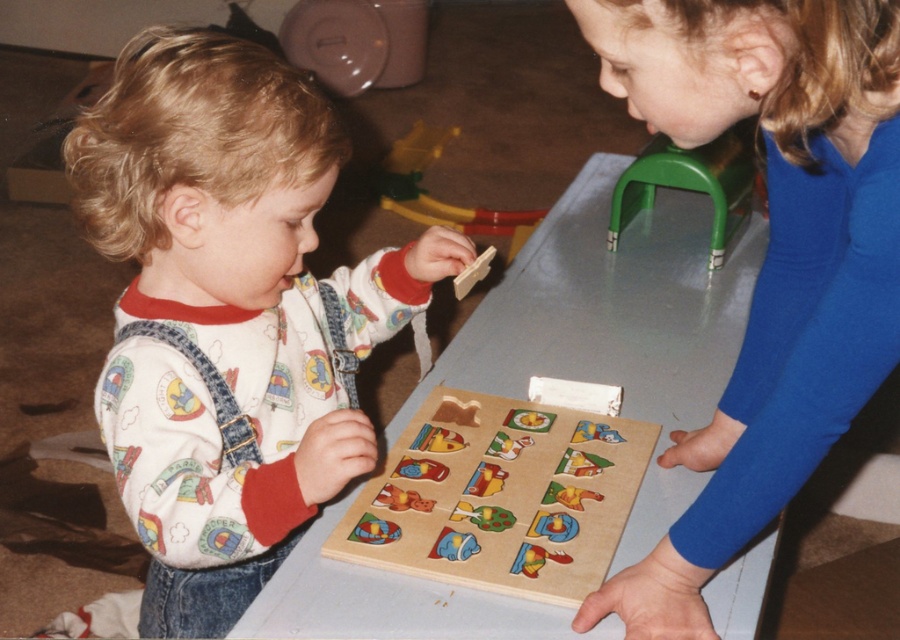
Question: Does white cotton shirt at center appear on the right side of green plastic stool at upper center?

Choices:
 (A) no
 (B) yes

Answer: (A)

Question: Estimate the real-world distances between objects in this image. Which object is closer to the green plastic stool at upper center?

Choices:
 (A) wooden puzzle at center
 (B) white cotton shirt at center

Answer: (A)

Question: Which of these objects is positioned closest to the wooden puzzle at center?

Choices:
 (A) green plastic stool at upper center
 (B) white cotton shirt at center
 (C) blue smooth shirt at upper right

Answer: (C)

Question: Is white cotton shirt at center in front of blue smooth shirt at upper right?

Choices:
 (A) no
 (B) yes

Answer: (A)

Question: Can you confirm if white cotton shirt at center is bigger than blue smooth shirt at upper right?

Choices:
 (A) no
 (B) yes

Answer: (B)

Question: Which point is closer to the camera?

Choices:
 (A) white cotton shirt at center
 (B) blue smooth shirt at upper right
 (C) green plastic stool at upper center
 (D) wooden puzzle at center

Answer: (B)